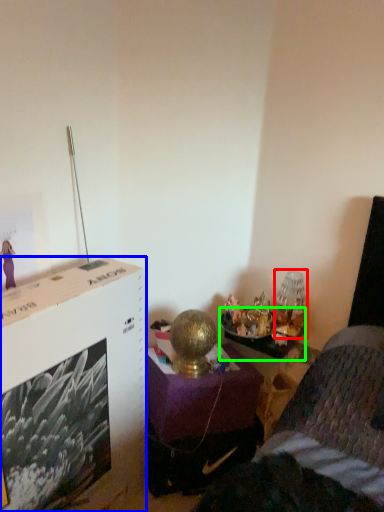
Question: Which is nearer to the table lamp (highlighted by a red box)? file cabinet (highlighted by a blue box) or table (highlighted by a green box).

Choices:
 (A) file cabinet
 (B) table

Answer: (B)